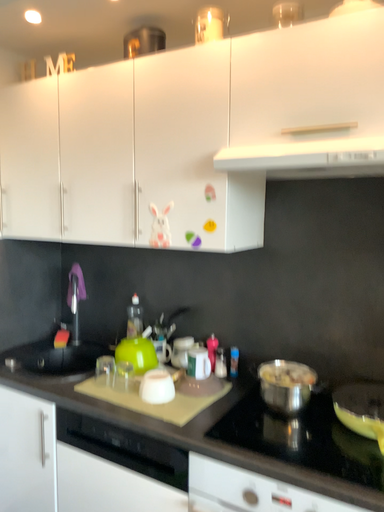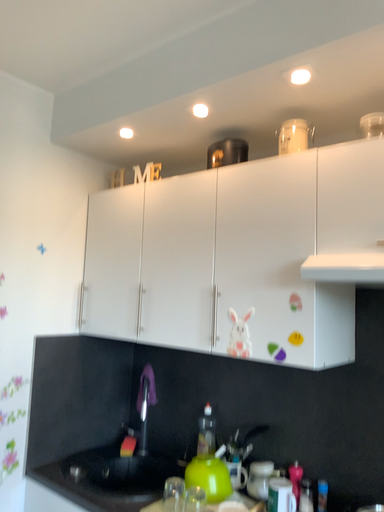
Question: Which way did the camera rotate in the video?

Choices:
 (A) rotated downward
 (B) rotated upward

Answer: (B)